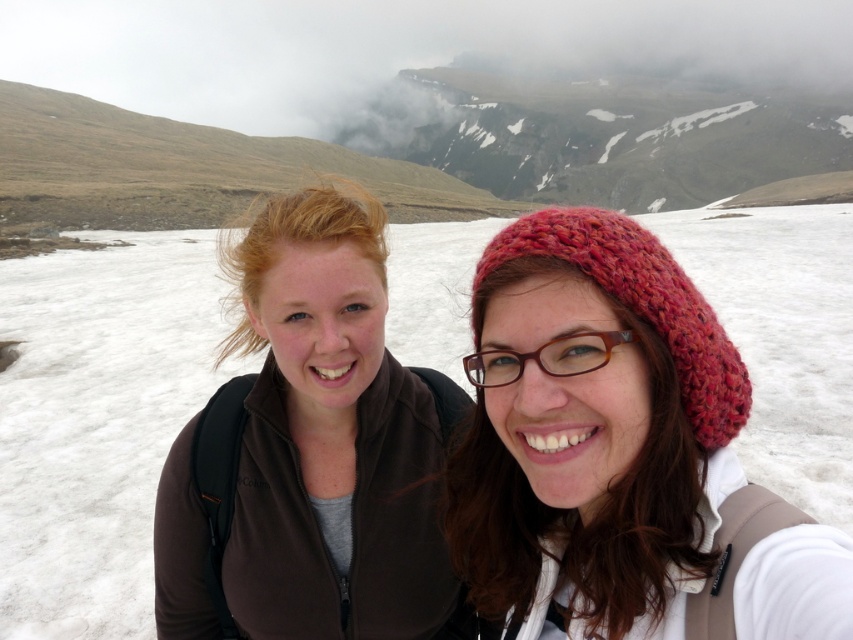
Can you confirm if brown fleece jacket at center is bigger than white fluffy cloud at upper center?

No.

Can you confirm if brown fleece jacket at center is wider than white fluffy cloud at upper center?

No, brown fleece jacket at center is not wider than white fluffy cloud at upper center.

The height and width of the screenshot is (640, 853). In order to click on brown fleece jacket at center in this screenshot , I will do `click(309, 449)`.

Does knitted wool beret at center have a smaller size compared to brown plastic glasses at center?

Actually, knitted wool beret at center might be larger than brown plastic glasses at center.

This screenshot has height=640, width=853. What do you see at coordinates (593, 433) in the screenshot?
I see `knitted wool beret at center` at bounding box center [593, 433].

Find the location of a particular element. knitted wool beret at center is located at coordinates (593, 433).

Is knitted wool beret at center taller than knitted woolen hat at right?

Indeed, knitted wool beret at center has a greater height compared to knitted woolen hat at right.

Which is in front, point (772, 529) or point (730, 394)?

Positioned in front is point (772, 529).

Where is `knitted wool beret at center`? The width and height of the screenshot is (853, 640). knitted wool beret at center is located at coordinates (593, 433).